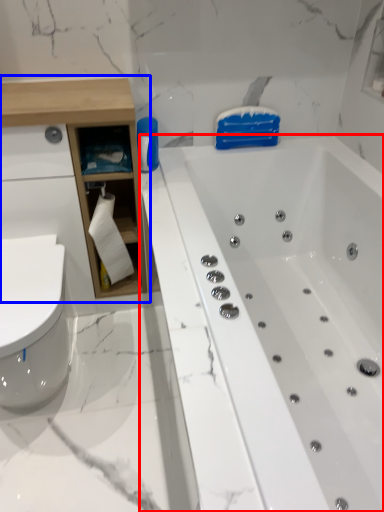
Question: Which of the following is the closest to the observer, bathtub (highlighted by a red box) or cabinetry (highlighted by a blue box)?

Choices:
 (A) bathtub
 (B) cabinetry

Answer: (A)